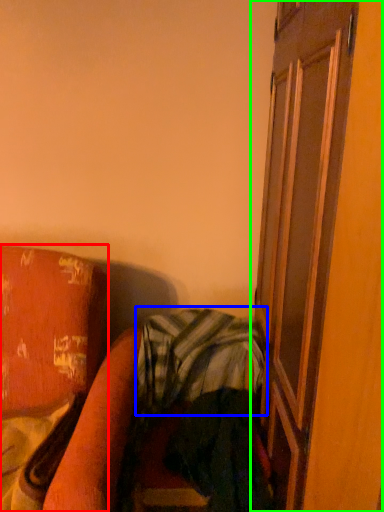
Question: Which is farther away from furniture (highlighted by a red box)? plaid (highlighted by a blue box) or screen door (highlighted by a green box)?

Choices:
 (A) plaid
 (B) screen door

Answer: (B)